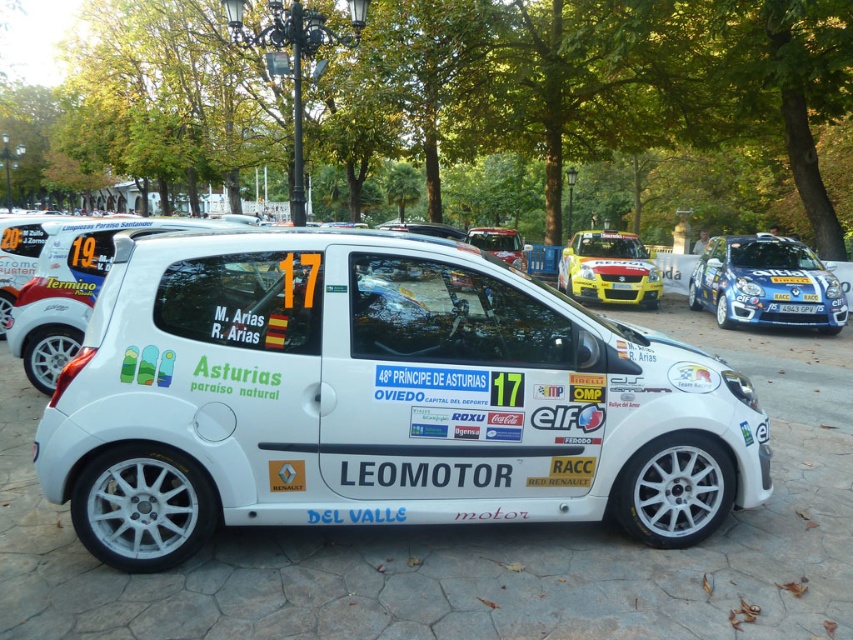
Question: Which object appears farthest from the camera in this image?

Choices:
 (A) white matte rally car at center
 (B) white plastic license plate at center
 (C) white matte car at center

Answer: (C)

Question: Considering the real-world distances, which object is farthest from the white matte car at center?

Choices:
 (A) white matte rally car at center
 (B) yellow matte hatchback at center
 (C) blue metallic hatchback at upper right

Answer: (A)

Question: Which of the following is the farthest from the observer?

Choices:
 (A) white matte car at center
 (B) blue metallic hatchback at upper right
 (C) white matte rally car at center

Answer: (A)

Question: Does blue metallic hatchback at upper right have a lesser width compared to yellow matte hatchback at center?

Choices:
 (A) no
 (B) yes

Answer: (A)

Question: Is blue metallic hatchback at upper right positioned behind yellow matte hatchback at center?

Choices:
 (A) no
 (B) yes

Answer: (A)

Question: Can you confirm if blue metallic hatchback at upper right is positioned to the right of white plastic license plate at center?

Choices:
 (A) yes
 (B) no

Answer: (A)